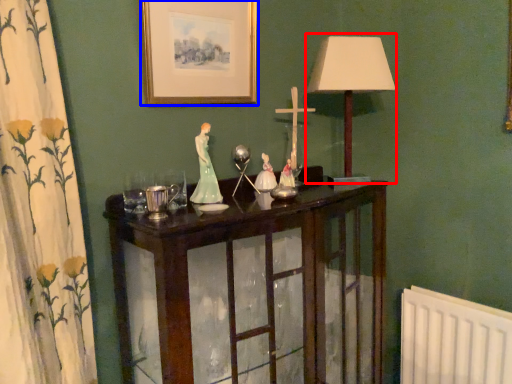
Question: Which of the following is the farthest to the observer, table lamp (highlighted by a red box) or picture frame (highlighted by a blue box)?

Choices:
 (A) table lamp
 (B) picture frame

Answer: (A)